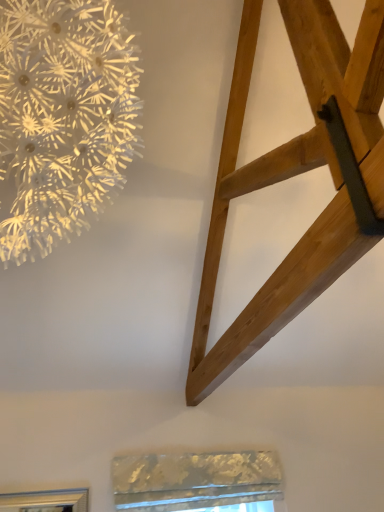
Question: Are natural wood ladder at upper right and metallic textured window at lower center far apart?

Choices:
 (A) no
 (B) yes

Answer: (B)

Question: Is natural wood ladder at upper right bigger than metallic textured window at lower center?

Choices:
 (A) yes
 (B) no

Answer: (A)

Question: Does natural wood ladder at upper right contain metallic textured window at lower center?

Choices:
 (A) yes
 (B) no

Answer: (B)

Question: From a real-world perspective, is natural wood ladder at upper right physically below metallic textured window at lower center?

Choices:
 (A) no
 (B) yes

Answer: (A)

Question: Considering the relative positions of natural wood ladder at upper right and metallic textured window at lower center in the image provided, is natural wood ladder at upper right behind metallic textured window at lower center?

Choices:
 (A) yes
 (B) no

Answer: (B)

Question: Is natural wood ladder at upper right facing towards metallic textured window at lower center?

Choices:
 (A) no
 (B) yes

Answer: (A)

Question: Is white textured paper flower at upper left inside metallic textured window at lower center?

Choices:
 (A) yes
 (B) no

Answer: (B)

Question: From the image's perspective, is metallic textured window at lower center located beneath white textured paper flower at upper left?

Choices:
 (A) no
 (B) yes

Answer: (B)

Question: From a real-world perspective, is metallic textured window at lower center located beneath white textured paper flower at upper left?

Choices:
 (A) yes
 (B) no

Answer: (A)

Question: Is metallic textured window at lower center wider than white textured paper flower at upper left?

Choices:
 (A) no
 (B) yes

Answer: (A)

Question: Does metallic textured window at lower center come in front of white textured paper flower at upper left?

Choices:
 (A) yes
 (B) no

Answer: (B)

Question: Considering the relative positions of metallic textured window at lower center and white textured paper flower at upper left in the image provided, is metallic textured window at lower center to the right of white textured paper flower at upper left from the viewer's perspective?

Choices:
 (A) no
 (B) yes

Answer: (B)

Question: Is natural wood ladder at upper right completely or partially outside of white textured paper flower at upper left?

Choices:
 (A) no
 (B) yes

Answer: (B)